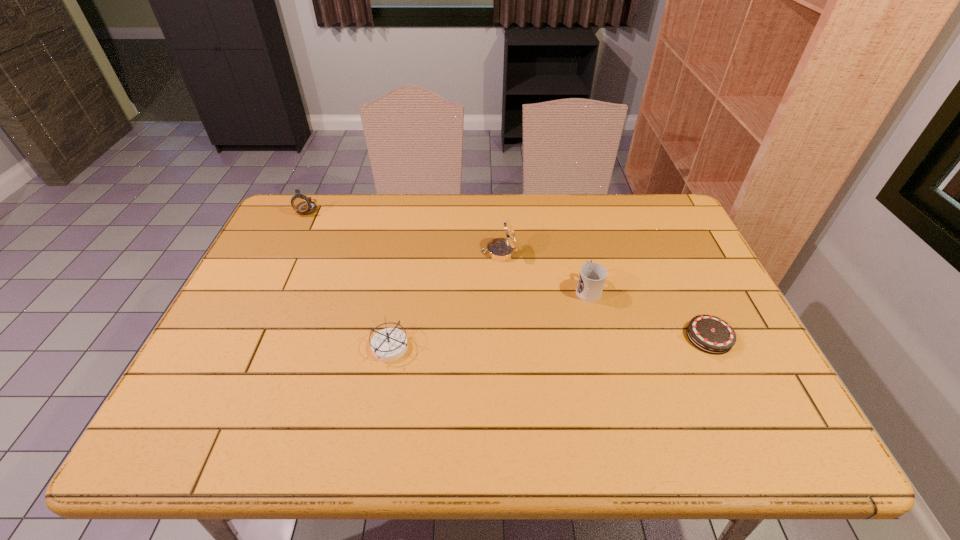
Locate an element on the screen. The height and width of the screenshot is (540, 960). the fourth nearest object is located at coordinates [499, 249].

Locate an element on the screen. The image size is (960, 540). the rightmost compass is located at coordinates (499, 249).

The width and height of the screenshot is (960, 540). Find the location of `the farthest object`. the farthest object is located at coordinates (302, 204).

Identify the location of the leftmost object. (302, 204).

The width and height of the screenshot is (960, 540). I want to click on the second object from right to left, so click(x=592, y=276).

You are a GUI agent. You are given a task and a screenshot of the screen. Output one action in this format:
    pyautogui.click(x=<x>, y=<y>)
    Task: Click on the third shortest object
    
    Given the screenshot: What is the action you would take?
    (592, 276)

Image resolution: width=960 pixels, height=540 pixels. I want to click on the fourth tallest object, so click(x=389, y=344).

The width and height of the screenshot is (960, 540). I want to click on the shortest compass, so click(x=389, y=344).

Locate an element on the screen. This screenshot has height=540, width=960. the rightmost object is located at coordinates (710, 334).

The image size is (960, 540). I want to click on the shortest object, so click(x=710, y=334).